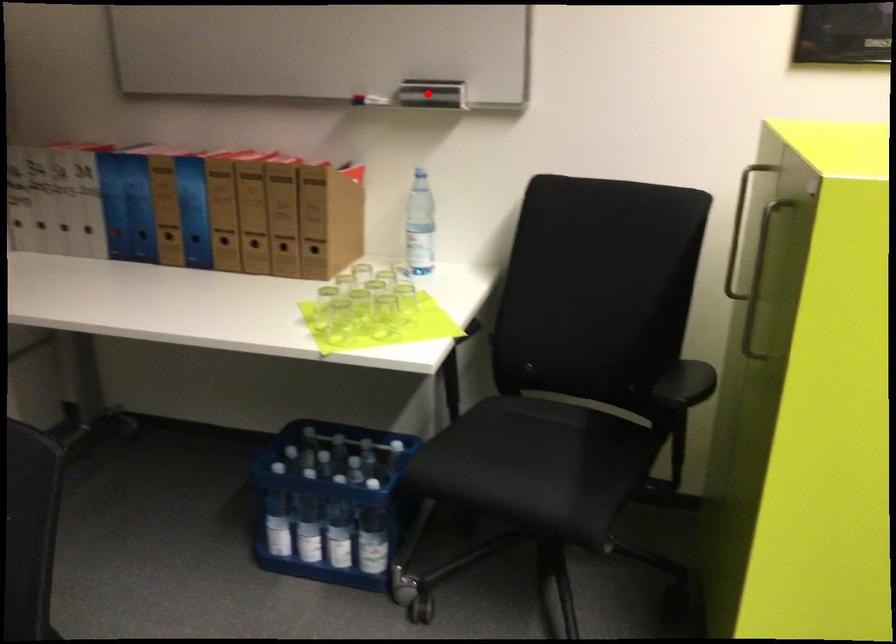
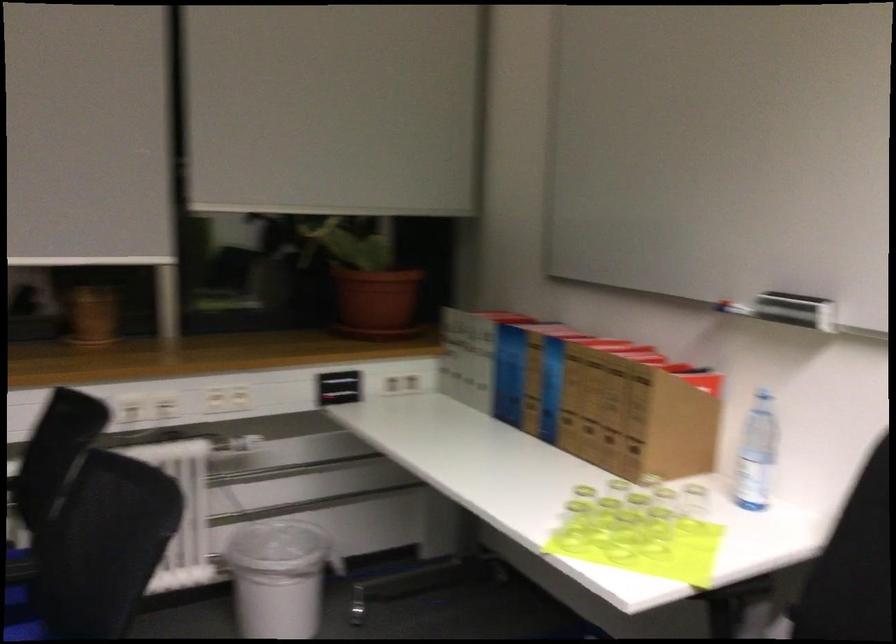
Question: I am providing you with two images of the same scene from different viewpoints. A red point is shown in image1. For the corresponding object point in image2, is it positioned nearer or farther from the camera?

Choices:
 (A) Nearer
 (B) Farther

Answer: (A)